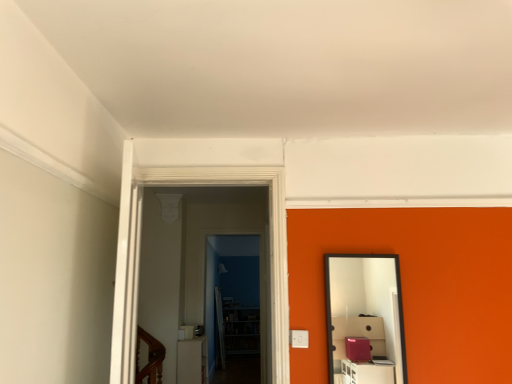
Question: In which direction should I rotate to look at transparent glass door at center, the 2th glass door when ordered from back to front?

Choices:
 (A) left
 (B) right

Answer: (A)

Question: From a real-world perspective, is transparent glass door at center, acting as the second glass door starting from the front, on transparent glass door at center, the 2th glass door when ordered from back to front?

Choices:
 (A) yes
 (B) no

Answer: (B)

Question: Does transparent glass door at center, acting as the second glass door starting from the front, have a greater width compared to transparent glass door at center, positioned as the 1th glass door in front-to-back order?

Choices:
 (A) yes
 (B) no

Answer: (B)

Question: Is transparent glass door at center, arranged as the first glass door when viewed from the back, facing towards transparent glass door at center, positioned as the 1th glass door in front-to-back order?

Choices:
 (A) no
 (B) yes

Answer: (B)

Question: Is transparent glass door at center, arranged as the first glass door when viewed from the back, directly adjacent to transparent glass door at center, positioned as the 1th glass door in front-to-back order?

Choices:
 (A) yes
 (B) no

Answer: (B)

Question: Is transparent glass door at center, acting as the second glass door starting from the front, to the left of transparent glass door at center, positioned as the 1th glass door in front-to-back order, from the viewer's perspective?

Choices:
 (A) no
 (B) yes

Answer: (A)

Question: Is transparent glass door at center, arranged as the first glass door when viewed from the back, not near transparent glass door at center, the 2th glass door when ordered from back to front?

Choices:
 (A) yes
 (B) no

Answer: (A)

Question: Is white glossy light switch at center positioned in front of black framed mirror at right?

Choices:
 (A) yes
 (B) no

Answer: (B)

Question: Can you confirm if white glossy light switch at center is shorter than black framed mirror at right?

Choices:
 (A) no
 (B) yes

Answer: (B)

Question: From the image's perspective, is white glossy light switch at center above black framed mirror at right?

Choices:
 (A) no
 (B) yes

Answer: (A)

Question: Can we say white glossy light switch at center lies outside black framed mirror at right?

Choices:
 (A) no
 (B) yes

Answer: (B)

Question: Is white glossy light switch at center positioned with its back to black framed mirror at right?

Choices:
 (A) no
 (B) yes

Answer: (A)

Question: Considering the relative sizes of white glossy light switch at center and black framed mirror at right in the image provided, is white glossy light switch at center wider than black framed mirror at right?

Choices:
 (A) no
 (B) yes

Answer: (B)

Question: Is transparent glass door at center, the 2th glass door when ordered from back to front, completely or partially outside of black framed mirror at right?

Choices:
 (A) yes
 (B) no

Answer: (A)